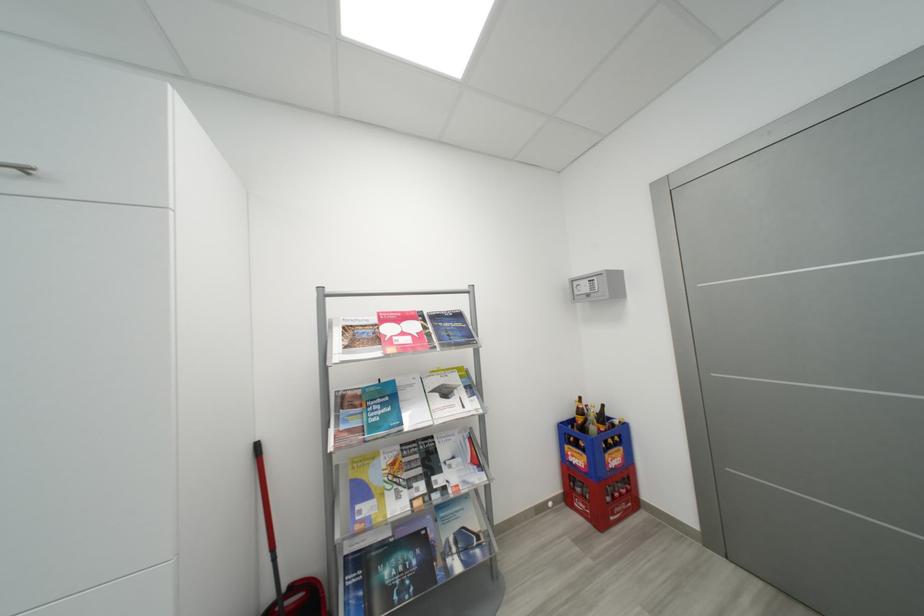
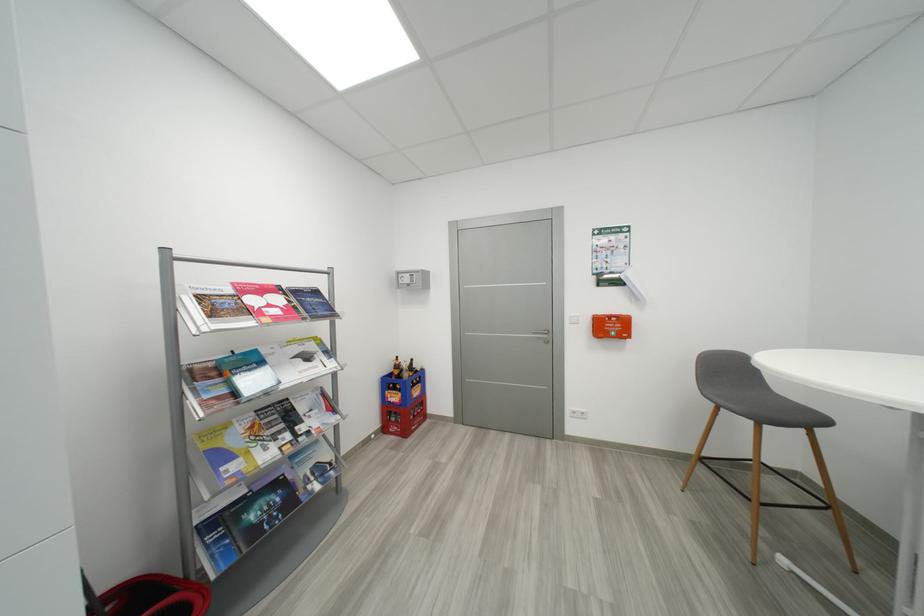
Locate, in the second image, the point that corresponds to point (575, 501) in the first image.

(392, 431)